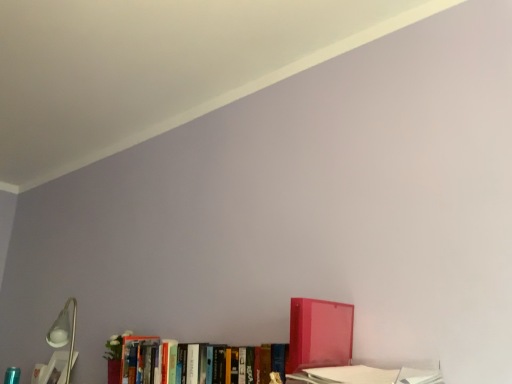
Question: Can you confirm if translucent red binder at lower right, arranged as the first book when viewed from the right, is thinner than hardcover books at center, the second book in the right-to-left sequence?

Choices:
 (A) yes
 (B) no

Answer: (B)

Question: From a real-world perspective, is translucent red binder at lower right, which is counted as the 3th book, starting from the left, on hardcover books at center, marked as the second book in a left-to-right arrangement?

Choices:
 (A) no
 (B) yes

Answer: (B)

Question: Does translucent red binder at lower right, arranged as the first book when viewed from the right, touch hardcover books at center, marked as the second book in a left-to-right arrangement?

Choices:
 (A) yes
 (B) no

Answer: (B)

Question: Considering the relative positions of translucent red binder at lower right, arranged as the first book when viewed from the right, and hardcover books at center, the second book in the right-to-left sequence, in the image provided, is translucent red binder at lower right, arranged as the first book when viewed from the right, to the right of hardcover books at center, the second book in the right-to-left sequence, from the viewer's perspective?

Choices:
 (A) no
 (B) yes

Answer: (B)

Question: Is translucent red binder at lower right, the 1th book from the front, turned away from hardcover books at center, which is the 2th book from back to front?

Choices:
 (A) yes
 (B) no

Answer: (B)

Question: From a real-world perspective, is hardcover book at lower left, which is the 1th book in left-to-right order, physically located above or below translucent red binder at lower right, which is counted as the 3th book, starting from the left?

Choices:
 (A) above
 (B) below

Answer: (B)

Question: Is hardcover book at lower left, which is counted as the 3th book, starting from the right, in front of or behind translucent red binder at lower right, which is counted as the 3th book, starting from the left, in the image?

Choices:
 (A) front
 (B) behind

Answer: (B)

Question: From their relative heights in the image, would you say hardcover book at lower left, which is counted as the 3th book, starting from the right, is taller or shorter than translucent red binder at lower right, which is the third book in back-to-front order?

Choices:
 (A) tall
 (B) short

Answer: (B)

Question: From the image's perspective, relative to translucent red binder at lower right, the 1th book from the front, is hardcover book at lower left, which is counted as the 3th book, starting from the right, above or below?

Choices:
 (A) above
 (B) below

Answer: (B)

Question: Is hardcover books at center, which is the 2th book from back to front, situated inside hardcover book at lower left, which is counted as the 3th book, starting from the front, or outside?

Choices:
 (A) inside
 (B) outside

Answer: (B)

Question: From the image's perspective, is hardcover books at center, marked as the second book in a left-to-right arrangement, located above or below hardcover book at lower left, which is counted as the 3th book, starting from the right?

Choices:
 (A) below
 (B) above

Answer: (B)

Question: Is point (135, 360) positioned closer to the camera than point (42, 365)?

Choices:
 (A) farther
 (B) closer

Answer: (B)

Question: From their relative heights in the image, would you say hardcover books at center, the second book in the right-to-left sequence, is taller or shorter than hardcover book at lower left, which is the 1th book in left-to-right order?

Choices:
 (A) short
 (B) tall

Answer: (A)

Question: Would you say hardcover book at lower left, placed as the 1th book when sorted from back to front, is to the left or to the right of hardcover books at center, marked as the second book in a left-to-right arrangement, in the picture?

Choices:
 (A) right
 (B) left

Answer: (B)

Question: From a real-world perspective, is hardcover book at lower left, placed as the 1th book when sorted from back to front, above or below hardcover books at center, the second book in the right-to-left sequence?

Choices:
 (A) below
 (B) above

Answer: (A)